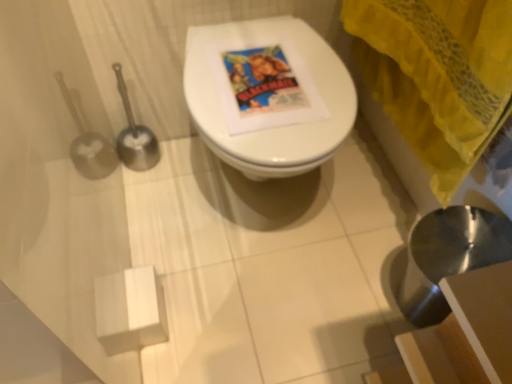
Question: Is yellow fabric curtain at upper right closer to camera compared to white glossy toilet at center?

Choices:
 (A) no
 (B) yes

Answer: (B)

Question: Is yellow fabric curtain at upper right oriented away from white glossy toilet at center?

Choices:
 (A) yes
 (B) no

Answer: (B)

Question: From a real-world perspective, is yellow fabric curtain at upper right located beneath white glossy toilet at center?

Choices:
 (A) yes
 (B) no

Answer: (B)

Question: Considering the relative sizes of yellow fabric curtain at upper right and white glossy toilet at center in the image provided, is yellow fabric curtain at upper right thinner than white glossy toilet at center?

Choices:
 (A) no
 (B) yes

Answer: (B)

Question: Is yellow fabric curtain at upper right not close to white glossy toilet at center?

Choices:
 (A) no
 (B) yes

Answer: (A)

Question: Is metallic silver sink at lower right taller or shorter than white glossy toilet at center?

Choices:
 (A) tall
 (B) short

Answer: (A)

Question: From a real-world perspective, relative to white glossy toilet at center, is metallic silver sink at lower right vertically above or below?

Choices:
 (A) above
 (B) below

Answer: (A)

Question: Considering their positions, is metallic silver sink at lower right located in front of or behind white glossy toilet at center?

Choices:
 (A) front
 (B) behind

Answer: (A)

Question: Is metallic silver sink at lower right bigger or smaller than white glossy toilet at center?

Choices:
 (A) big
 (B) small

Answer: (B)

Question: From the image's perspective, is yellow fabric curtain at upper right located above or below metallic silver sink at lower right?

Choices:
 (A) above
 (B) below

Answer: (A)

Question: Does point (478, 145) appear closer or farther from the camera than point (418, 301)?

Choices:
 (A) farther
 (B) closer

Answer: (B)

Question: Is yellow fabric curtain at upper right taller or shorter than metallic silver sink at lower right?

Choices:
 (A) tall
 (B) short

Answer: (B)

Question: Visually, is yellow fabric curtain at upper right positioned to the left or to the right of metallic silver sink at lower right?

Choices:
 (A) right
 (B) left

Answer: (B)

Question: In terms of size, does metallic silver sink at lower right appear bigger or smaller than yellow fabric curtain at upper right?

Choices:
 (A) small
 (B) big

Answer: (A)

Question: Looking at their shapes, would you say metallic silver sink at lower right is wider or thinner than yellow fabric curtain at upper right?

Choices:
 (A) wide
 (B) thin

Answer: (A)